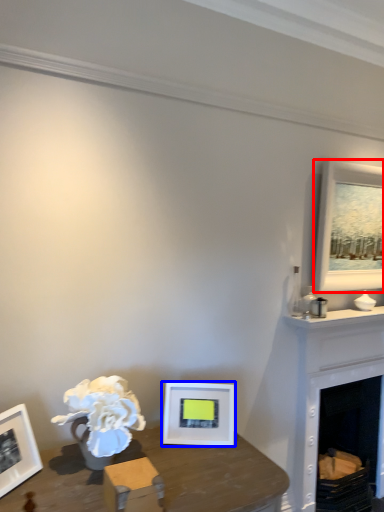
Question: Among these objects, which one is farthest to the camera, picture frame (highlighted by a red box) or picture frame (highlighted by a blue box)?

Choices:
 (A) picture frame
 (B) picture frame

Answer: (A)